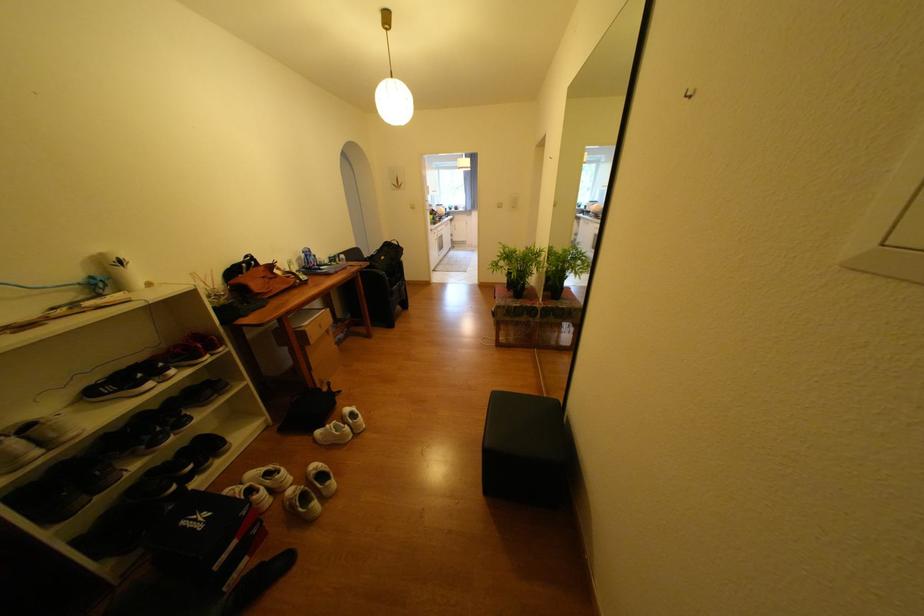
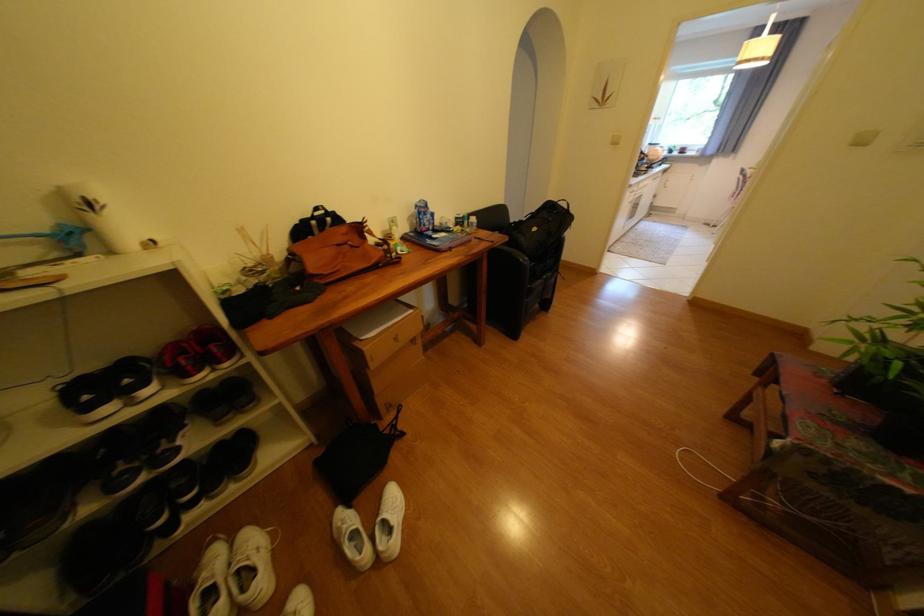
Locate, in the second image, the point that corresponds to pixel 508 207 in the first image.

(872, 142)